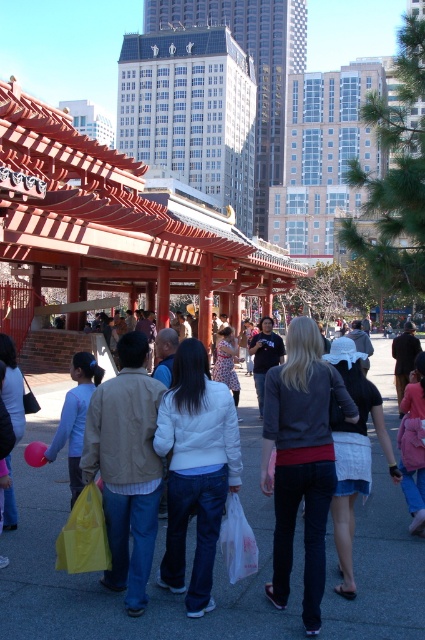
Question: Which of the following is the closest to the observer?

Choices:
 (A) denim jacket at center
 (B) smooth glass skyscraper at upper center
 (C) white matte jacket at center

Answer: (A)

Question: Where is dark gray sweater at center located in relation to white matte jacket at center in the image?

Choices:
 (A) above
 (B) below

Answer: (A)

Question: Does white matte jacket at center have a smaller size compared to smooth glass skyscraper at upper center?

Choices:
 (A) no
 (B) yes

Answer: (B)

Question: Is denim jacket at center in front of yellow plastic bag at lower left?

Choices:
 (A) no
 (B) yes

Answer: (B)

Question: Which point is farther to the camera?

Choices:
 (A) smooth glass skyscraper at upper center
 (B) denim jacket at center

Answer: (A)

Question: Which of these objects is positioned farthest from the denim jacket at center?

Choices:
 (A) white matte jacket at center
 (B) smooth glass skyscraper at upper center
 (C) yellow plastic bag at lower left
 (D) dark gray sweater at center

Answer: (B)